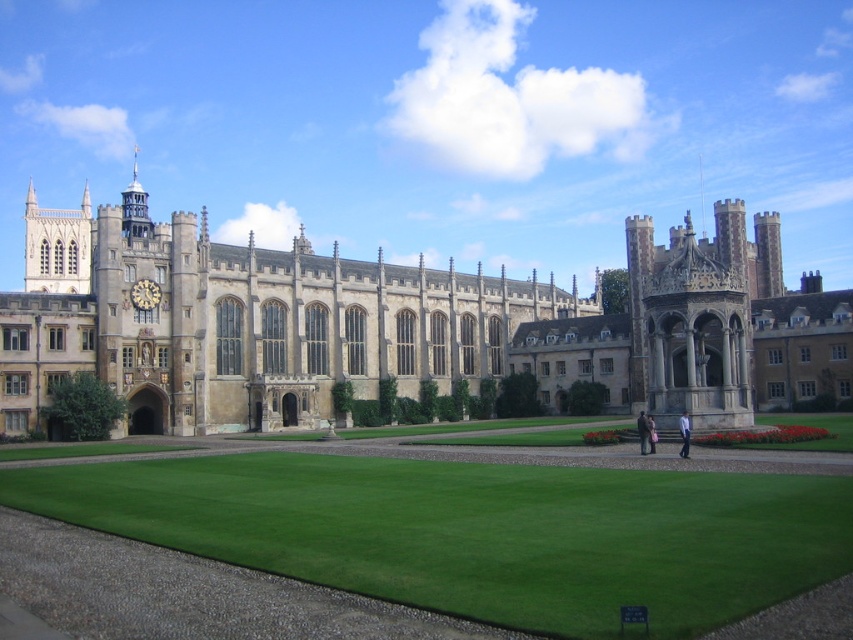
You are a landscape architect planning to install a new water feature between the stone building at center and the green lawn at center. Given that the water feature requires a minimum of 100 feet of space between the building and the lawn to be installed safely, is the current distance sufficient?

The distance between the stone building at center and the green lawn at center is 116.64 feet, which exceeds the required 100 feet. Therefore, the water feature can be safely installed between them.

You are standing on the gravel path in front of the stone building at center and the green lawn at center. Which object is closer to you?

The stone building at center is closer to you than the green lawn at center because it is positioned further to the viewer.